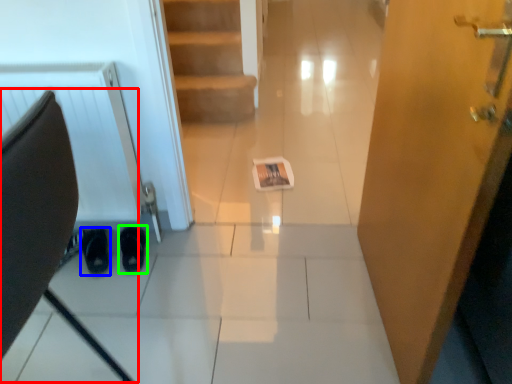
Question: Based on their relative distances, which object is farther from swivel chair (highlighted by a red box)? Choose from footwear (highlighted by a blue box) and footwear (highlighted by a green box).

Choices:
 (A) footwear
 (B) footwear

Answer: (A)